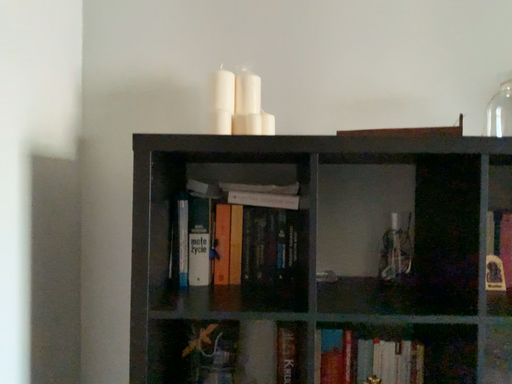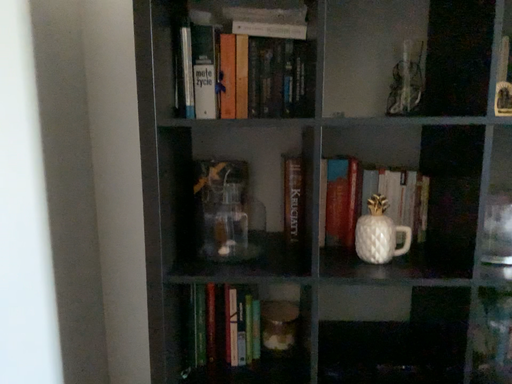
Question: Which way did the camera rotate in the video?

Choices:
 (A) rotated downward
 (B) rotated upward

Answer: (A)